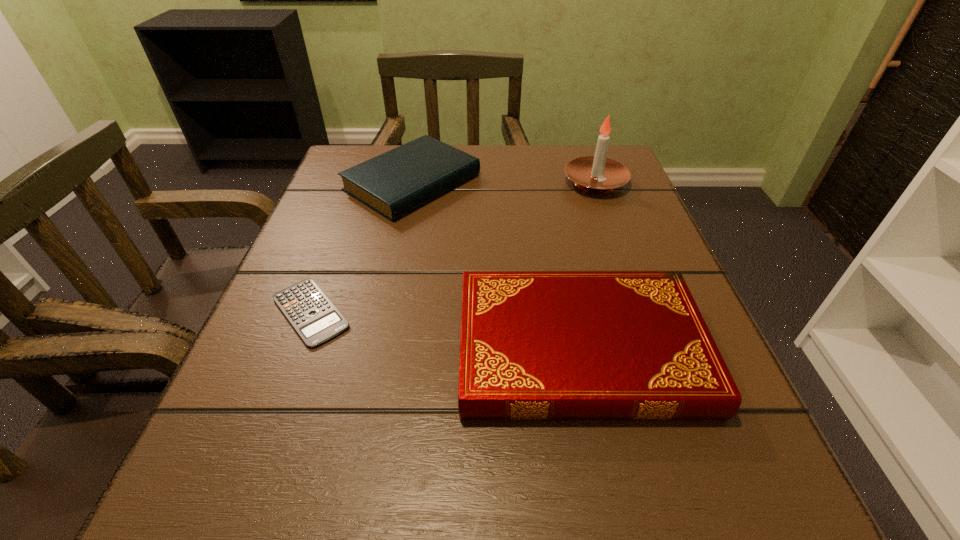
Where is `the tallest object`? the tallest object is located at coordinates (596, 174).

The height and width of the screenshot is (540, 960). In order to click on the nearer book in this screenshot , I will do `click(534, 345)`.

Where is `the farther book`? the farther book is located at coordinates point(399,181).

Identify the location of the shortest object. (314, 317).

What are the coordinates of `vacant space situated on the left of the candle` in the screenshot? It's located at (513, 183).

Locate an element on the screen. The image size is (960, 540). vacant space located on the cover of the nearer book is located at coordinates (266, 349).

I want to click on vacant area situated 0.210m on the cover of the nearer book, so click(x=315, y=349).

Locate an element on the screen. Image resolution: width=960 pixels, height=540 pixels. free space located 0.150m on the cover of the nearer book is located at coordinates (356, 349).

Locate an element on the screen. This screenshot has height=540, width=960. free location located 0.240m on the right of the farther book is located at coordinates (590, 183).

The image size is (960, 540). What are the coordinates of `vacant region located on the back of the shortest object` in the screenshot? It's located at (335, 246).